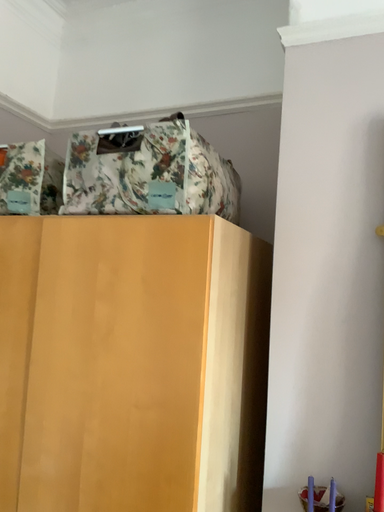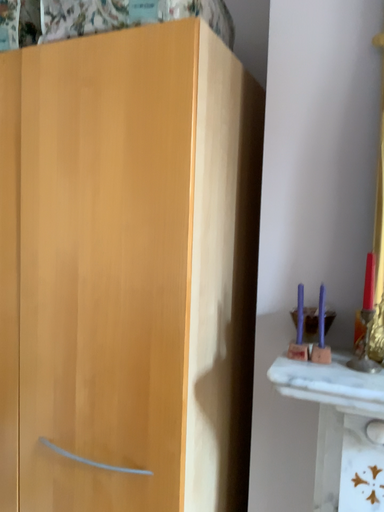
Question: How did the camera likely rotate when shooting the video?

Choices:
 (A) rotated downward
 (B) rotated upward

Answer: (A)